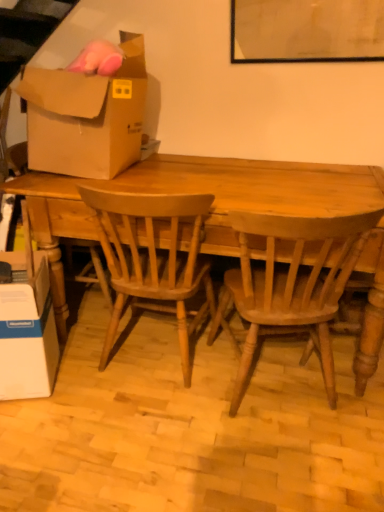
The width and height of the screenshot is (384, 512). Identify the location of vacant area that lies to the right of brown cardboard box at upper left, placed as the 2th box when sorted from bottom to top. [x=210, y=166].